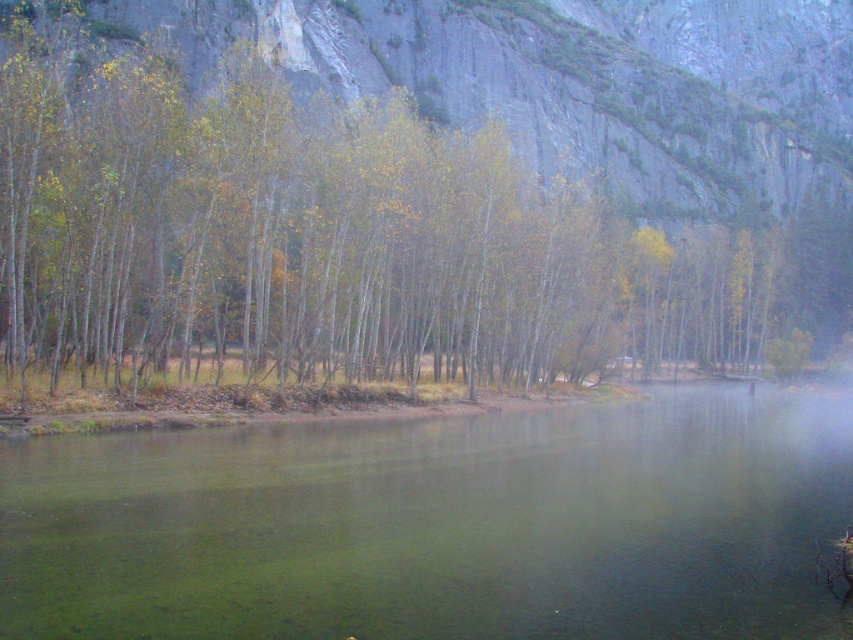
Does point (512, 182) come closer to viewer compared to point (384, 612)?

No, (512, 182) is further to viewer.

Does green matte trees at center appear on the right side of green translucent water at center?

Yes, green matte trees at center is to the right of green translucent water at center.

Is point (235, 296) closer to viewer compared to point (737, 536)?

That is False.

Where is `green matte trees at center`? The height and width of the screenshot is (640, 853). green matte trees at center is located at coordinates (415, 189).